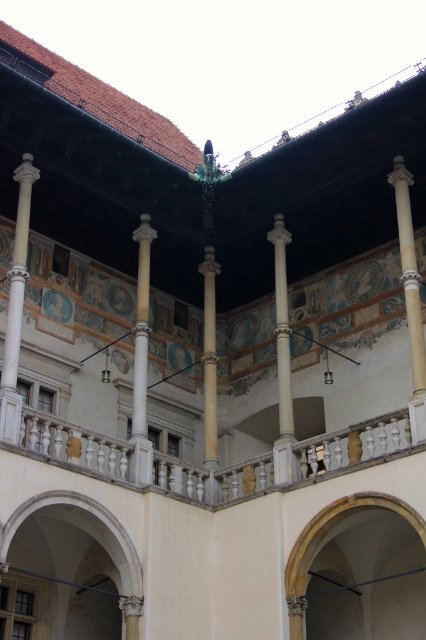
Question: Can you confirm if smooth stone archway at center is positioned to the left of polished stone column at center?

Choices:
 (A) no
 (B) yes

Answer: (A)

Question: Is smooth stone archway at center behind polished stone column at center?

Choices:
 (A) yes
 (B) no

Answer: (B)

Question: Which is farther from the white marble column at left?

Choices:
 (A) white marble column at center
 (B) white marble column at right
 (C) smooth stone archway at center

Answer: (B)

Question: Which point is closer to the camera?

Choices:
 (A) white stone column at center
 (B) white marble column at left
 (C) polished stone column at center

Answer: (B)

Question: Does white marble column at left have a smaller size compared to white stone column at center?

Choices:
 (A) no
 (B) yes

Answer: (A)

Question: Which of the following is the farthest from the observer?

Choices:
 (A) white marble column at left
 (B) white stone column at center
 (C) white marble column at center
 (D) white marble column at right

Answer: (B)